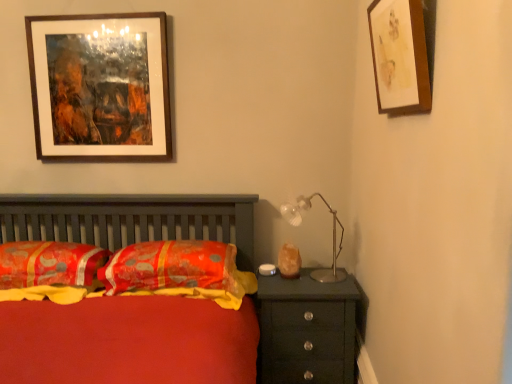
Question: Is orange printed fabric pillow at center, which is counted as the 2th pillow, starting from the left, outside of silky orange pillow at center, which appears as the 2th pillow when viewed from the right?

Choices:
 (A) yes
 (B) no

Answer: (A)

Question: Is the surface of orange printed fabric pillow at center, which ranks as the first pillow in right-to-left order, in direct contact with silky orange pillow at center, which appears as the 2th pillow when viewed from the right?

Choices:
 (A) yes
 (B) no

Answer: (B)

Question: Is silky orange pillow at center, the 1th pillow in the left-to-right sequence, completely or partially inside orange printed fabric pillow at center, which is counted as the 2th pillow, starting from the left?

Choices:
 (A) yes
 (B) no

Answer: (B)

Question: From a real-world perspective, is orange printed fabric pillow at center, which ranks as the first pillow in right-to-left order, beneath silky orange pillow at center, the 1th pillow in the left-to-right sequence?

Choices:
 (A) yes
 (B) no

Answer: (A)

Question: Considering the relative sizes of orange printed fabric pillow at center, which ranks as the first pillow in right-to-left order, and silky orange pillow at center, which appears as the 2th pillow when viewed from the right, in the image provided, is orange printed fabric pillow at center, which ranks as the first pillow in right-to-left order, shorter than silky orange pillow at center, which appears as the 2th pillow when viewed from the right,?

Choices:
 (A) no
 (B) yes

Answer: (B)

Question: From the image's perspective, is orange printed fabric pillow at center, which ranks as the first pillow in right-to-left order, beneath silky orange pillow at center, which appears as the 2th pillow when viewed from the right?

Choices:
 (A) yes
 (B) no

Answer: (A)

Question: Is metallic silver table lamp at upper right thinner than silky orange pillow at center, the 1th pillow in the left-to-right sequence?

Choices:
 (A) no
 (B) yes

Answer: (B)

Question: Considering the relative sizes of metallic silver table lamp at upper right and silky orange pillow at center, which appears as the 2th pillow when viewed from the right, in the image provided, is metallic silver table lamp at upper right taller than silky orange pillow at center, which appears as the 2th pillow when viewed from the right,?

Choices:
 (A) yes
 (B) no

Answer: (A)

Question: Are metallic silver table lamp at upper right and silky orange pillow at center, the 1th pillow in the left-to-right sequence, located far from each other?

Choices:
 (A) yes
 (B) no

Answer: (A)

Question: Could silky orange pillow at center, which appears as the 2th pillow when viewed from the right, be considered to be inside metallic silver table lamp at upper right?

Choices:
 (A) yes
 (B) no

Answer: (B)

Question: Is metallic silver table lamp at upper right to the left of silky orange pillow at center, the 1th pillow in the left-to-right sequence, from the viewer's perspective?

Choices:
 (A) yes
 (B) no

Answer: (B)

Question: Would you say metallic silver table lamp at upper right is outside silky orange pillow at center, the 1th pillow in the left-to-right sequence?

Choices:
 (A) yes
 (B) no

Answer: (A)

Question: Does wooden picture frame at upper left, which is the first picture frame from left to right, appear on the right side of metallic silver table lamp at upper right?

Choices:
 (A) no
 (B) yes

Answer: (A)